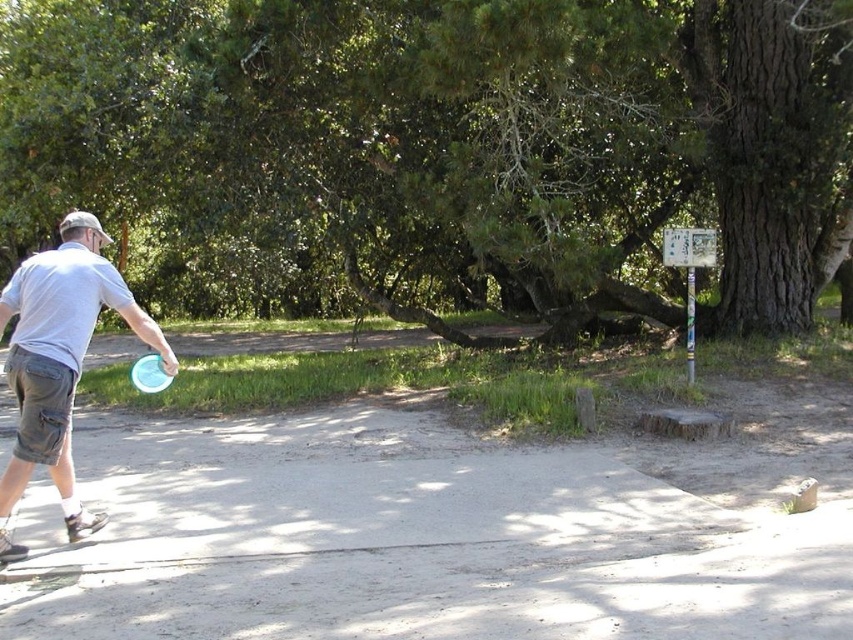
Is white matte frisbee at left further to the viewer compared to blue plastic frisbee at left?

No, it is not.

How far apart are white matte frisbee at left and blue plastic frisbee at left?

white matte frisbee at left is 88.20 centimeters from blue plastic frisbee at left.

Which is behind, point (28, 468) or point (141, 356)?

The point (141, 356) is behind.

Where is `white matte frisbee at left`? white matte frisbee at left is located at coordinates (59, 360).

Between green leafy tree at upper center and white matte frisbee at left, which one is positioned lower?

white matte frisbee at left is lower down.

Between green leafy tree at upper center and white matte frisbee at left, which one is positioned higher?

green leafy tree at upper center is higher up.

Which is behind, point (357, 4) or point (77, 349)?

Point (357, 4)

I want to click on green leafy tree at upper center, so click(x=445, y=147).

Which is more to the left, green leafy tree at upper center or blue plastic frisbee at left?

From the viewer's perspective, green leafy tree at upper center appears more on the left side.

Is point (296, 176) farther from camera compared to point (144, 392)?

That is True.

You are a GUI agent. You are given a task and a screenshot of the screen. Output one action in this format:
    pyautogui.click(x=<x>, y=<y>)
    Task: Click on the green leafy tree at upper center
    The image size is (853, 640).
    Given the screenshot: What is the action you would take?
    pyautogui.click(x=445, y=147)